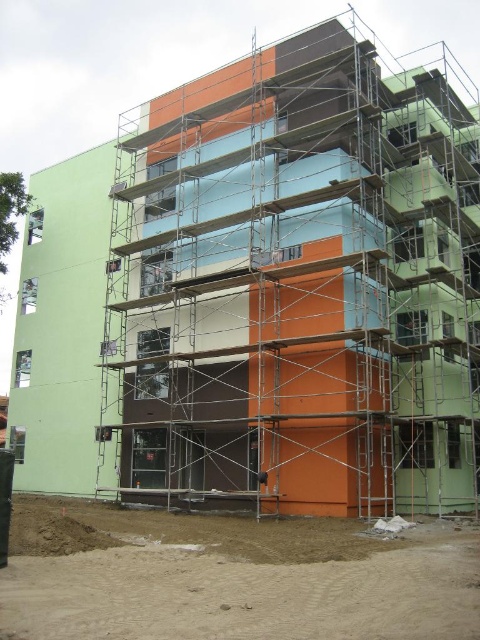
Question: Can you confirm if metal scaffolding at center is wider than sandy dirt at lower left?

Choices:
 (A) no
 (B) yes

Answer: (B)

Question: Can you confirm if metal scaffolding at center is positioned above sandy dirt at lower left?

Choices:
 (A) yes
 (B) no

Answer: (A)

Question: Among these points, which one is farthest from the camera?

Choices:
 (A) (298, 160)
 (B) (73, 616)

Answer: (A)

Question: Is metal scaffolding at center smaller than sandy dirt at lower left?

Choices:
 (A) no
 (B) yes

Answer: (A)